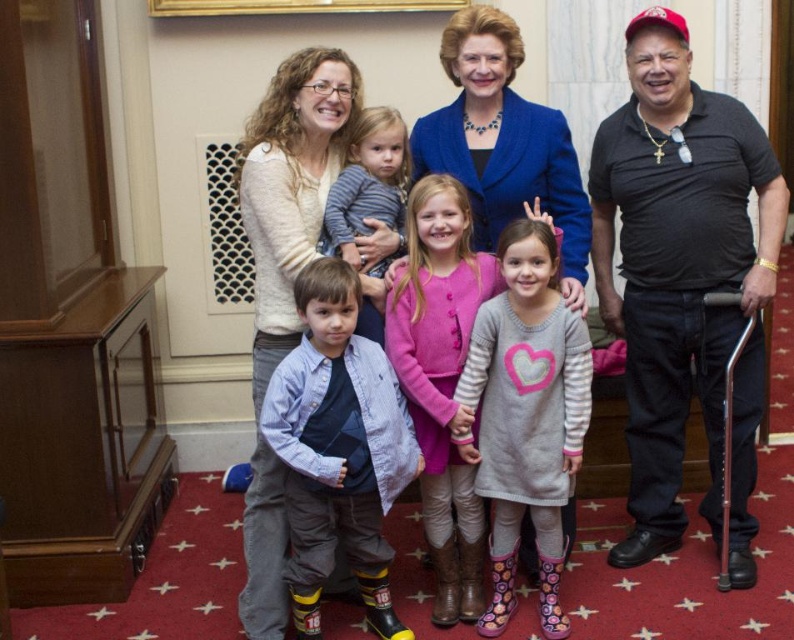
Question: Which point is farther to the camera?

Choices:
 (A) (311, 625)
 (B) (395, 120)
 (C) (654, 29)

Answer: (B)

Question: Is gray striped sweater at center below striped cotton shirt at center?

Choices:
 (A) yes
 (B) no

Answer: (A)

Question: Which object is closer to the camera taking this photo?

Choices:
 (A) blue denim shirt at center
 (B) matte black laptop at center

Answer: (A)

Question: Is blue denim shirt at center behind striped cotton shirt at center?

Choices:
 (A) yes
 (B) no

Answer: (B)

Question: Is black matte shirt at right smaller than striped cotton shirt at center?

Choices:
 (A) yes
 (B) no

Answer: (B)

Question: Which point is farther from the camera taking this photo?

Choices:
 (A) (469, 401)
 (B) (392, 228)
 (C) (646, 147)

Answer: (C)